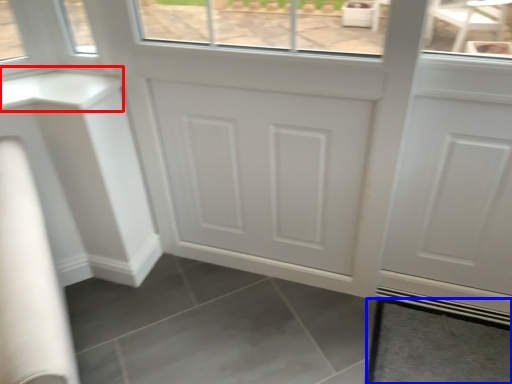
Question: Among these objects, which one is nearest to the camera, counter top (highlighted by a red box) or tile (highlighted by a blue box)?

Choices:
 (A) counter top
 (B) tile

Answer: (A)